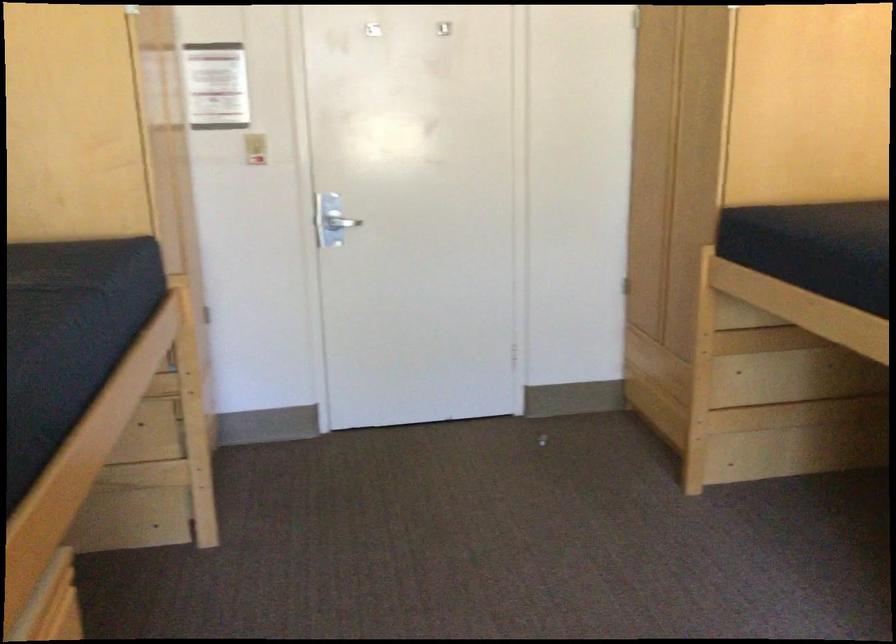
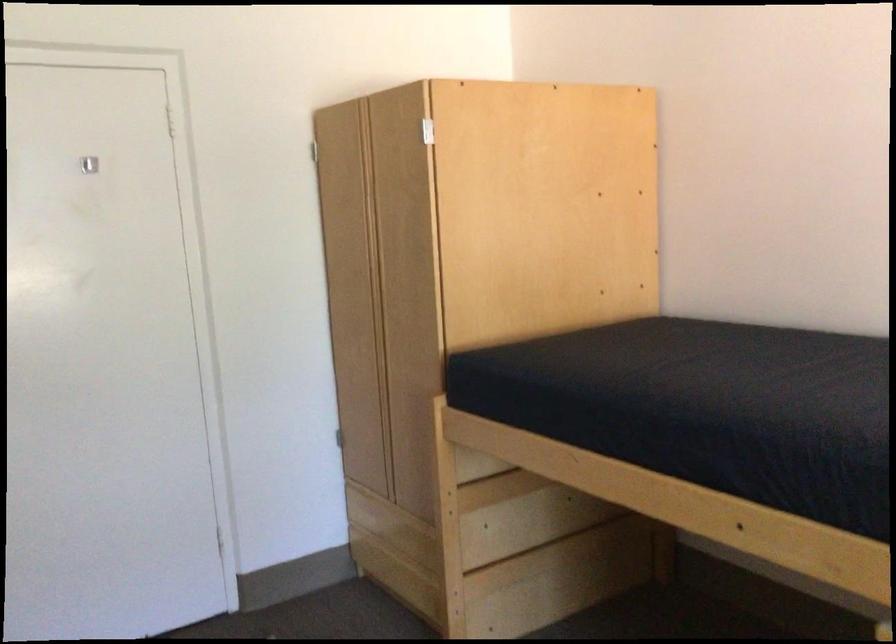
Question: Which direction would the cameraman need to move to produce the second image? Reply with the corresponding letter.

Choices:
 (A) Left
 (B) Right
 (C) Forward
 (D) Backward

Answer: (C)